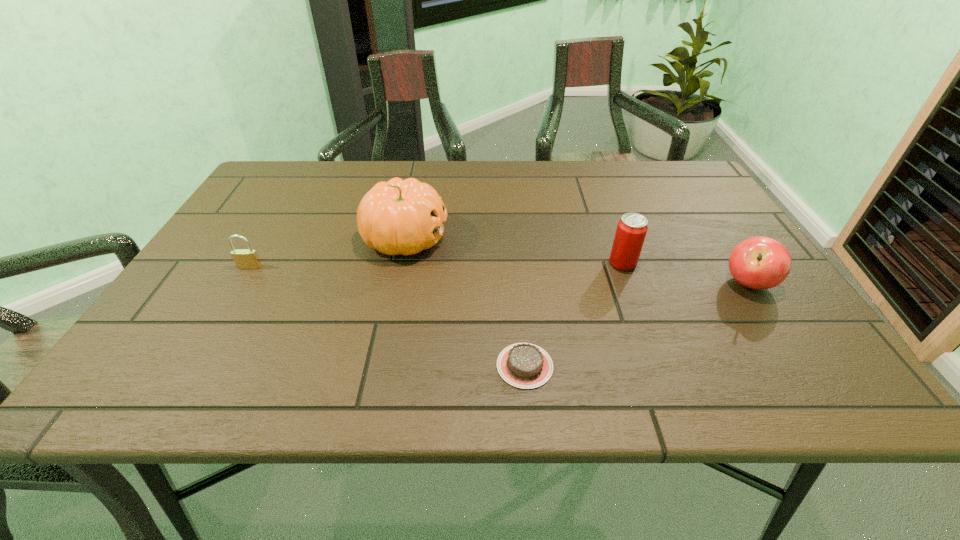
Where is `free space located 0.120m on the front of the rightmost object`? This screenshot has width=960, height=540. free space located 0.120m on the front of the rightmost object is located at coordinates (790, 346).

Identify the location of vacant space positioned on the front-facing side of the second shortest object. The width and height of the screenshot is (960, 540). (180, 383).

Where is `vacant space located on the back of the chocolate cake`? The height and width of the screenshot is (540, 960). vacant space located on the back of the chocolate cake is located at coordinates (521, 325).

At what (x,y) coordinates should I click in order to perform the action: click on object that is at the near edge. Please return your answer as a coordinate pair (x, y). The image size is (960, 540). Looking at the image, I should click on (523, 365).

I want to click on object that is at the left edge, so click(x=244, y=258).

Find the location of a particular element. object located in the right edge section of the desktop is located at coordinates (760, 262).

Image resolution: width=960 pixels, height=540 pixels. I want to click on vacant space at the far edge of the desktop, so click(339, 167).

What are the coordinates of `vacant area at the near edge of the desktop` in the screenshot? It's located at (439, 359).

The height and width of the screenshot is (540, 960). What are the coordinates of `vacant area at the left edge` in the screenshot? It's located at (180, 329).

Locate an element on the screen. This screenshot has height=540, width=960. vacant region at the right edge of the desktop is located at coordinates (732, 332).